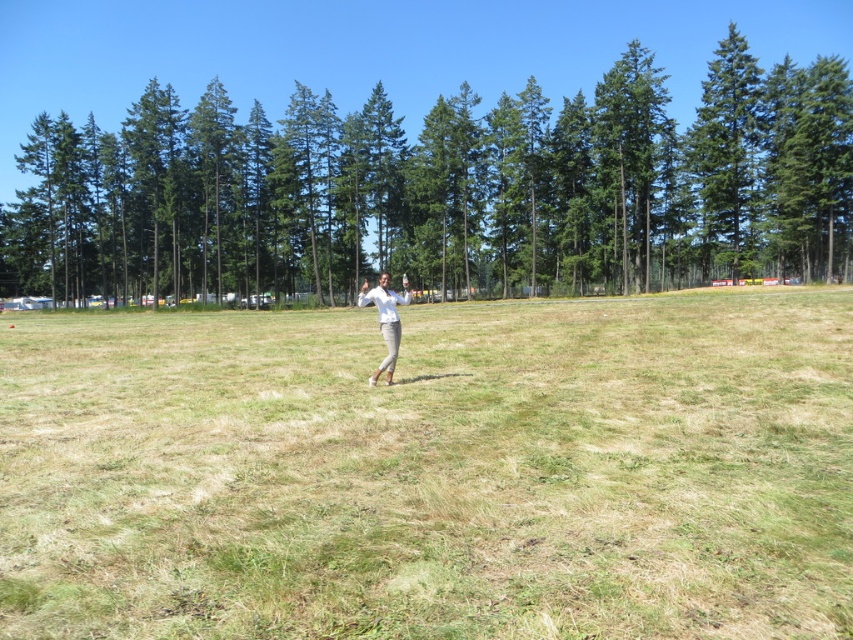
You are a drone operator trying to capture a photo of the person in the open grassy field. The person is standing at point [154,552]. You need to fly your drone from point [390,348] to the person. Since the field is uneven, you want to know if the path between these two points is clear of obstacles. Can you confirm if the path is clear?

Point [154,552] is closer to the camera than point [390,348]. Since the person is at the closer point, the drone can safely fly from the farther point to the person without obstacles because the path would be unobstructed in the open field.

You are standing at the point marked as point (4,476) in the image, which is 8.27 meters away from you. If you want to walk straight towards the dense line of tall evergreen trees in the background, will you pass through the grassy field?

Yes, since the point (4,476) is 8.27 meters away from you and the dense line of tall evergreen trees are in the background, walking straight towards the trees would take you through the grassy field.

You are a photographer trying to capture a wide shot of the scene. You notice the green dry grass at center and the white matte pants at center. Which object appears wider in the photo?

The green dry grass at center appears wider than the white matte pants at center because its width surpasses the pants.